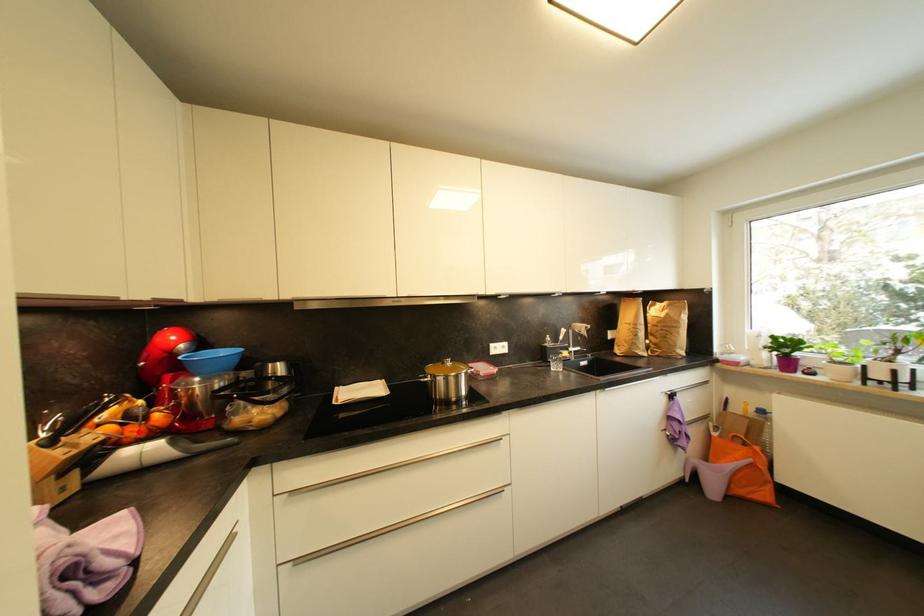
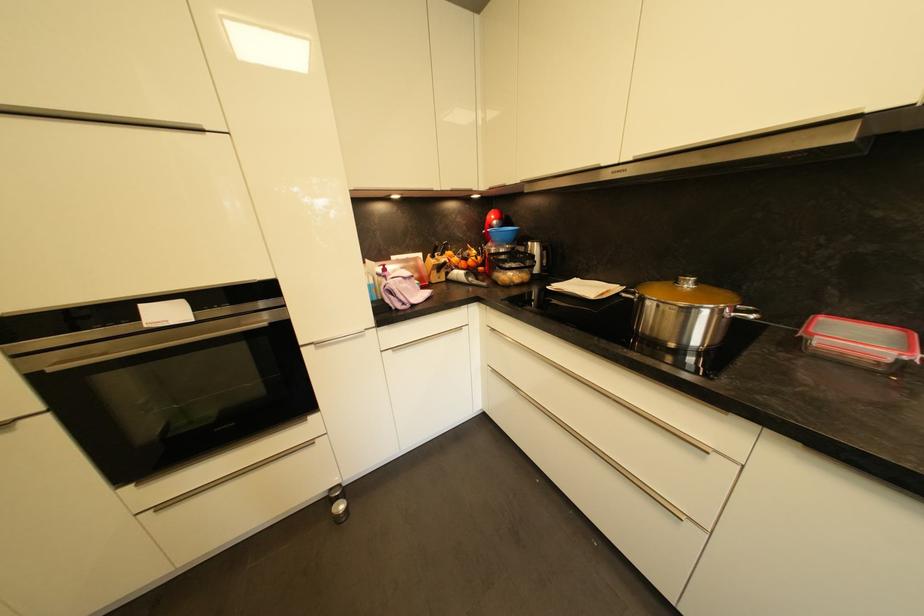
Find the pixel in the second image that matches the highlighted location in the first image.

(468, 265)